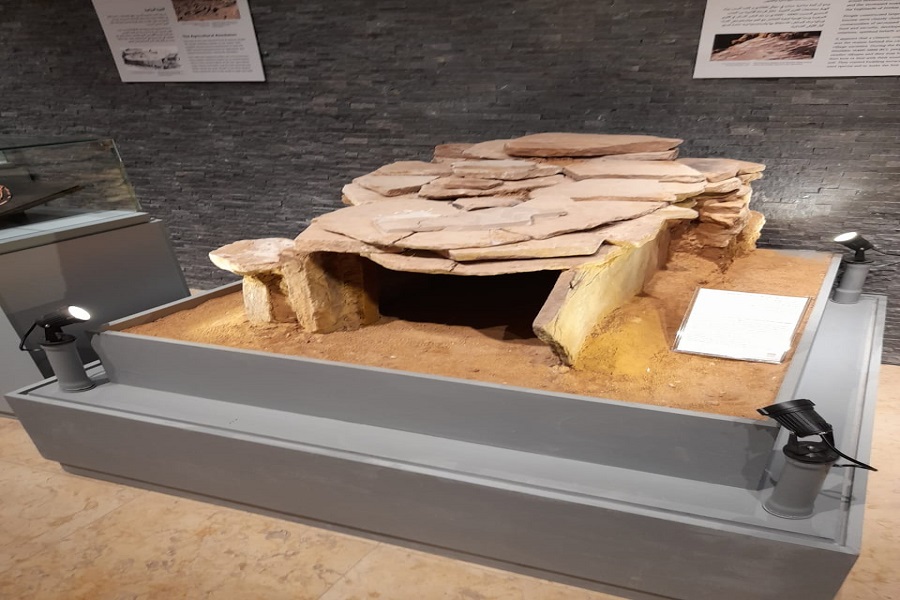
Locate an element on the screen. wall is located at coordinates pos(433,90).